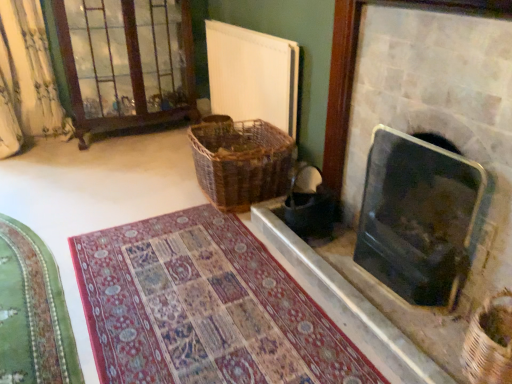
Question: Is dark brown woven laundry basket at center taller than green velvet mat at lower left, positioned as the first mat in left-to-right order?

Choices:
 (A) no
 (B) yes

Answer: (B)

Question: Considering the relative sizes of dark brown woven laundry basket at center and green velvet mat at lower left, the 2th mat when ordered from right to left, in the image provided, is dark brown woven laundry basket at center shorter than green velvet mat at lower left, the 2th mat when ordered from right to left,?

Choices:
 (A) no
 (B) yes

Answer: (A)

Question: From the image's perspective, is dark brown woven laundry basket at center on green velvet mat at lower left, positioned as the first mat in left-to-right order?

Choices:
 (A) yes
 (B) no

Answer: (A)

Question: Is dark brown woven laundry basket at center in contact with green velvet mat at lower left, positioned as the first mat in left-to-right order?

Choices:
 (A) no
 (B) yes

Answer: (A)

Question: Is dark brown woven laundry basket at center oriented away from green velvet mat at lower left, positioned as the first mat in left-to-right order?

Choices:
 (A) no
 (B) yes

Answer: (A)

Question: Can you confirm if dark brown woven laundry basket at center is bigger than green velvet mat at lower left, positioned as the first mat in left-to-right order?

Choices:
 (A) yes
 (B) no

Answer: (B)

Question: Are dark brown woven laundry basket at center and white matte radiator at upper center beside each other?

Choices:
 (A) yes
 (B) no

Answer: (B)

Question: Is dark brown woven laundry basket at center behind white matte radiator at upper center?

Choices:
 (A) no
 (B) yes

Answer: (A)

Question: Is dark brown woven laundry basket at center positioned far away from white matte radiator at upper center?

Choices:
 (A) yes
 (B) no

Answer: (B)

Question: Considering the relative sizes of dark brown woven laundry basket at center and white matte radiator at upper center in the image provided, is dark brown woven laundry basket at center bigger than white matte radiator at upper center?

Choices:
 (A) yes
 (B) no

Answer: (B)

Question: From a real-world perspective, is dark brown woven laundry basket at center beneath white matte radiator at upper center?

Choices:
 (A) yes
 (B) no

Answer: (A)

Question: Does dark brown woven laundry basket at center come in front of white matte radiator at upper center?

Choices:
 (A) yes
 (B) no

Answer: (A)

Question: Can you confirm if woven brown basket at lower right, placed as the second basket when sorted from top to bottom, is thinner than woven brown basket at center, which is the 2th basket in front-to-back order?

Choices:
 (A) yes
 (B) no

Answer: (A)